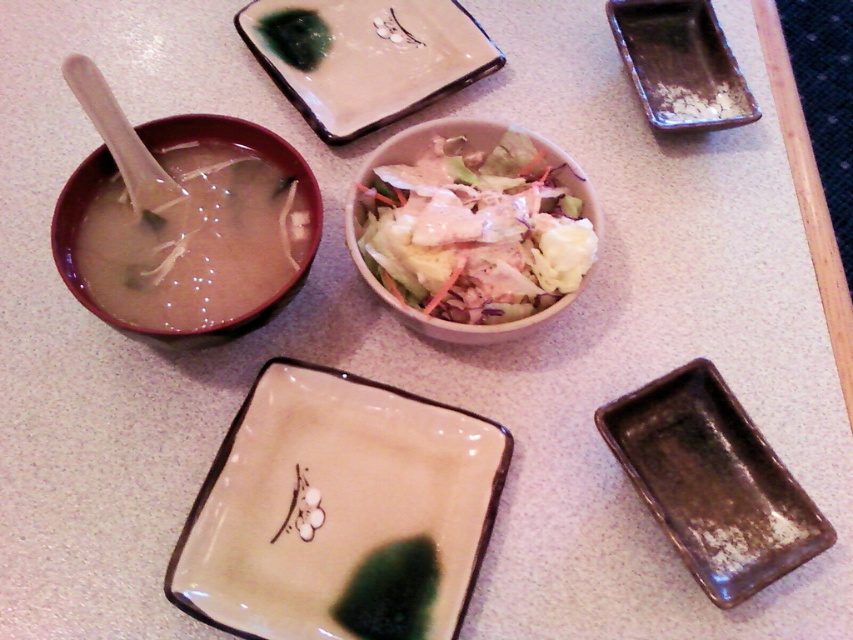
Consider the image. Is white glossy platter at upper center above brown ceramic bowl at upper left?

Indeed, white glossy platter at upper center is positioned over brown ceramic bowl at upper left.

This screenshot has width=853, height=640. I want to click on white glossy platter at upper center, so click(368, 58).

Does white creamy salad at center have a lesser height compared to brown ceramic bowl at upper left?

Yes, white creamy salad at center is shorter than brown ceramic bowl at upper left.

Is white creamy salad at center taller than brown ceramic bowl at upper left?

In fact, white creamy salad at center may be shorter than brown ceramic bowl at upper left.

Identify the location of white creamy salad at center. (471, 227).

This screenshot has height=640, width=853. Identify the location of white creamy salad at center. (471, 227).

Between brown glazed tray at lower right and brown ceramic bowl at upper left, which one has more height?

brown ceramic bowl at upper left

Is brown glazed tray at lower right below brown ceramic bowl at upper left?

Correct, brown glazed tray at lower right is located below brown ceramic bowl at upper left.

What do you see at coordinates (712, 483) in the screenshot? I see `brown glazed tray at lower right` at bounding box center [712, 483].

The image size is (853, 640). Find the location of `brown glazed tray at lower right`. brown glazed tray at lower right is located at coordinates (712, 483).